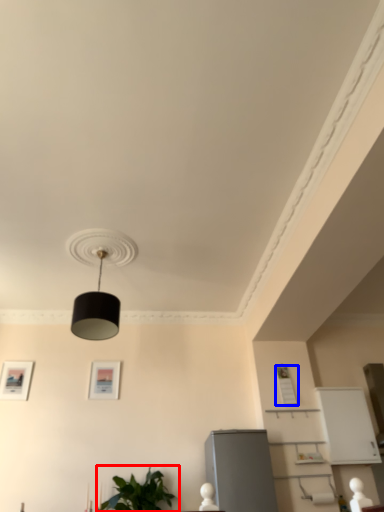
Question: Which object is closer to the camera taking this photo, houseplant (highlighted by a red box) or picture frame (highlighted by a blue box)?

Choices:
 (A) houseplant
 (B) picture frame

Answer: (A)